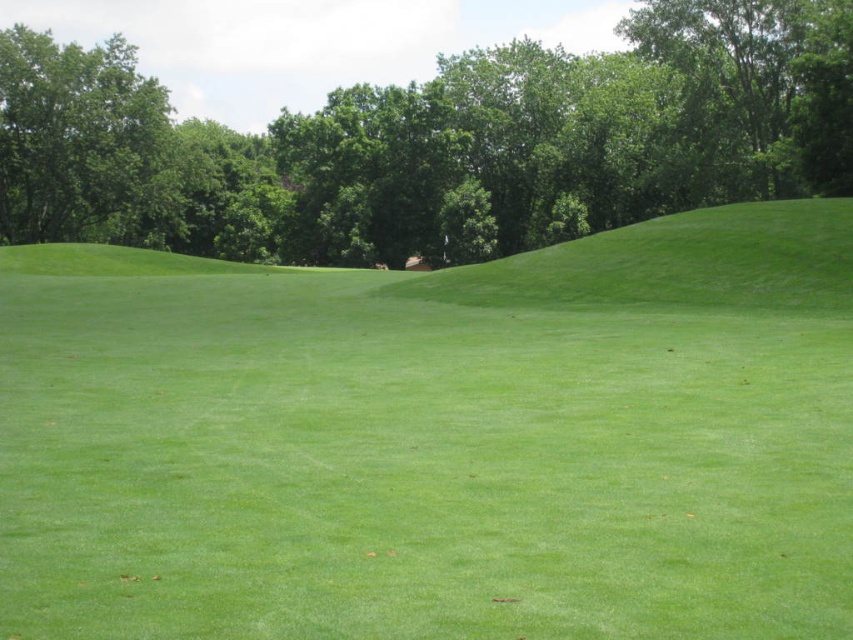
You are standing on the green grass at center and want to walk towards the green leafy tree at upper center. Which direction should you move to reach it?

To reach the green leafy tree at upper center, you should move upward from the green grass at center since the tree is positioned above it.

You are a gardener who needs to mow the lawn. You see the green grass at center and the green leafy tree at upper left. Which area requires mowing first based on their current heights?

The green grass at center requires mowing first because it is shorter than the green leafy tree at upper left, indicating it needs maintenance to maintain its height.

You are standing on the green grass at center and want to walk towards the green grassy hillside at upper right. Which direction should you move to get closer to the hillside?

To get closer to the green grassy hillside at upper right, you should move forward since the green grass at center is already closer to the viewer than the hillside, indicating the hillside is further ahead in the landscape.